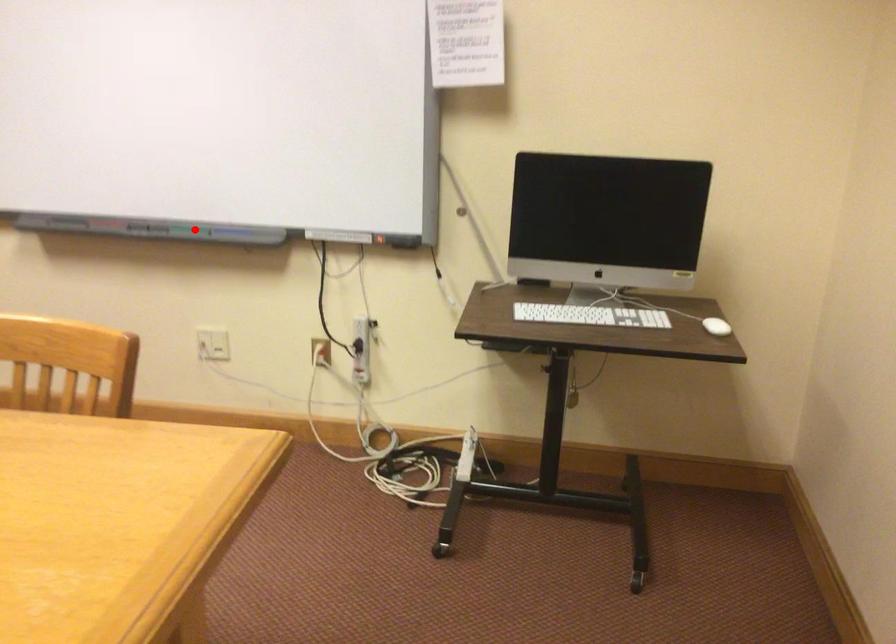
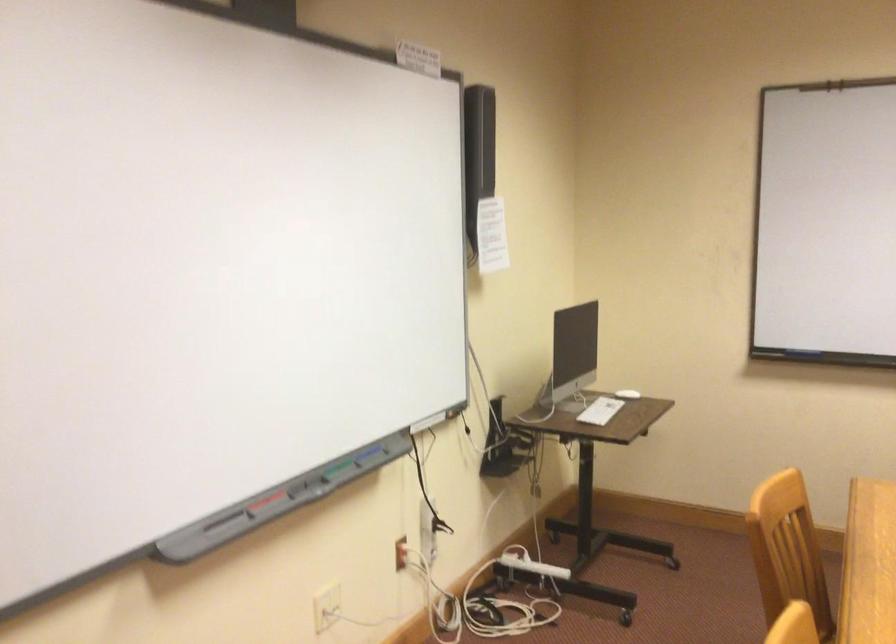
Question: I am providing you with two images of the same scene from different viewpoints. In image1, a red point is highlighted. Considering the same 3D point in image2, which of the following is correct?

Choices:
 (A) It is closer
 (B) It is farther

Answer: (A)